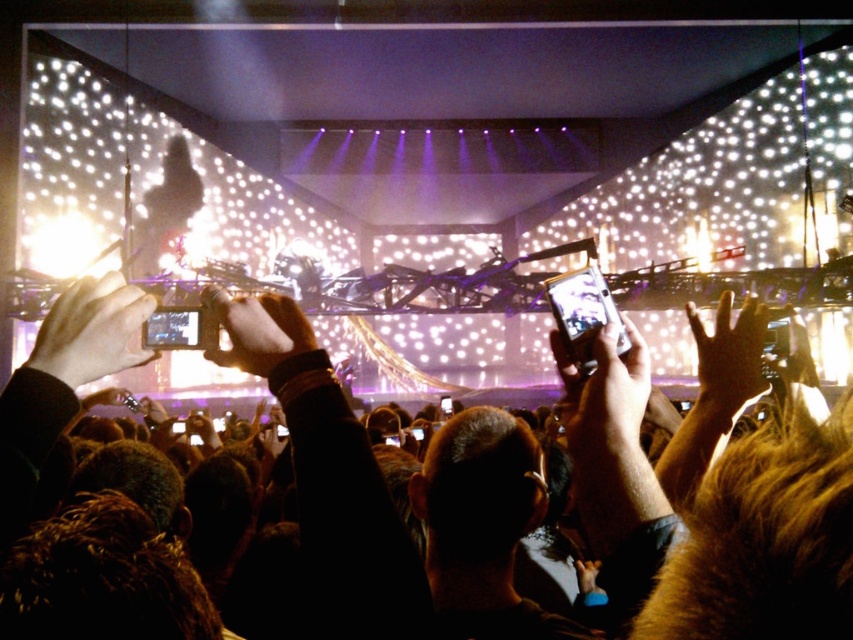
You are standing at the center of the concert venue and want to locate the dark brown leather jacket at center. According to the coordinates, where is it positioned relative to you?

The dark brown leather jacket at center is positioned at coordinates point (728,536) relative to the center of the image, which would place it slightly to the right and below the central point of the concert venue.

You are standing at the front of the concert stage and want to move towards the point labeled point [645,532]. However, there are obstacles blocking your path. Which direction should you move to reach it without going past point [204,349]?

Since point [645,532] is closer to the viewer than point [204,349], you should move forward towards the stage to reach it without passing the further point.

You are a photographer at the concert. You want to take a photo that includes both the dark brown leather jacket at center and the white matte phone at center. Which object should you focus on first to ensure both are in frame?

The dark brown leather jacket at center is taller than the white matte phone at center. Focus on the dark brown leather jacket at center first to ensure both objects are in frame.